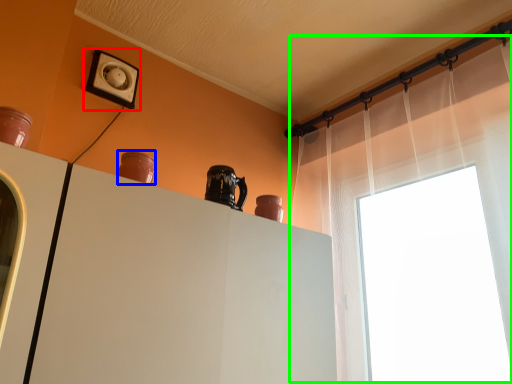
Question: Based on their relative distances, which object is farther from electric outlet (highlighted by a red box)? Choose from vase (highlighted by a blue box) and shower curtain (highlighted by a green box).

Choices:
 (A) vase
 (B) shower curtain

Answer: (B)